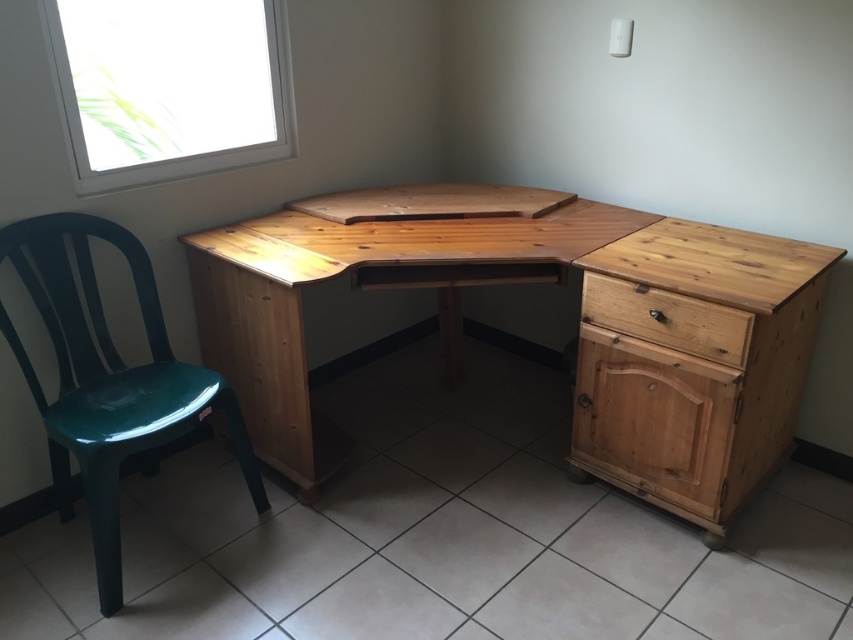
Is natural wood desk at center further to camera compared to green plastic chair at left?

That is False.

This screenshot has width=853, height=640. Describe the element at coordinates (436, 280) in the screenshot. I see `natural wood desk at center` at that location.

The image size is (853, 640). Find the location of `natural wood desk at center`. natural wood desk at center is located at coordinates (436, 280).

Which is in front, point (227, 275) or point (728, 406)?

Point (728, 406)

Can you confirm if natural wood desk at center is positioned above natural wood drawer at lower right?

Correct, natural wood desk at center is located above natural wood drawer at lower right.

This screenshot has width=853, height=640. What do you see at coordinates (436, 280) in the screenshot? I see `natural wood desk at center` at bounding box center [436, 280].

Identify the location of natural wood desk at center. This screenshot has height=640, width=853. (436, 280).

Is transparent glass window at upper left closer to the viewer compared to natural wood drawer at lower right?

No.

Which is in front, point (103, 173) or point (584, 362)?

Point (103, 173) is in front.

Between point (241, 115) and point (611, 374), which one is positioned behind?

Positioned behind is point (241, 115).

The height and width of the screenshot is (640, 853). What are the coordinates of `transparent glass window at upper left` in the screenshot? It's located at (169, 86).